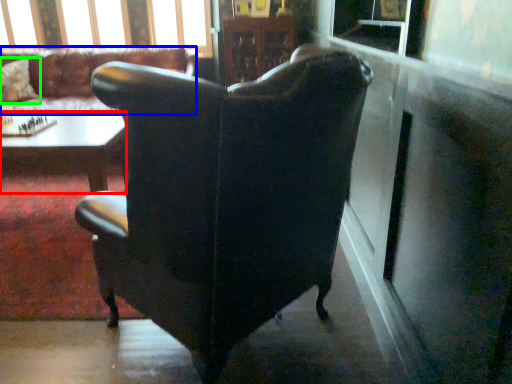
Question: Based on their relative distances, which object is nearer to table (highlighted by a red box)? Choose from chair (highlighted by a blue box) and pillow (highlighted by a green box).

Choices:
 (A) chair
 (B) pillow

Answer: (A)